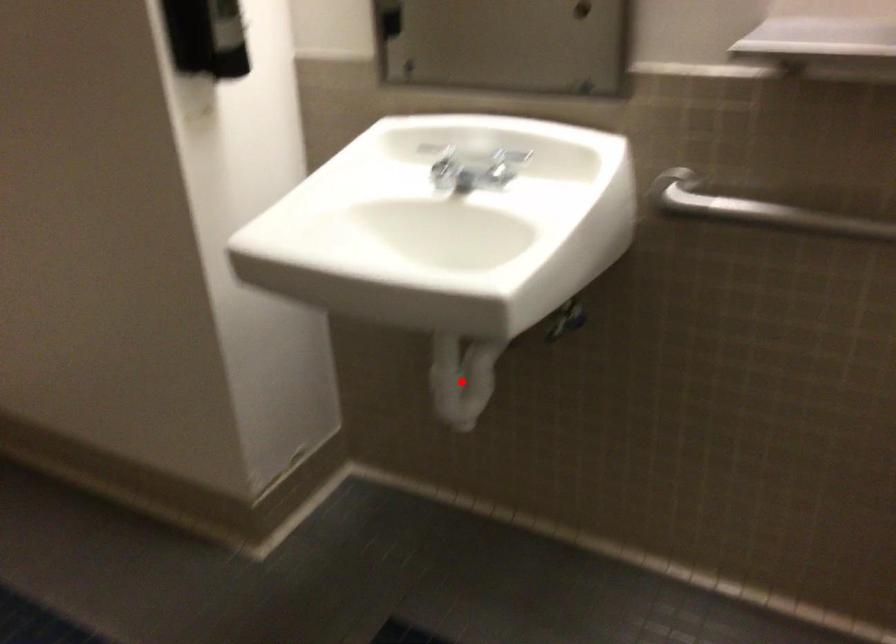
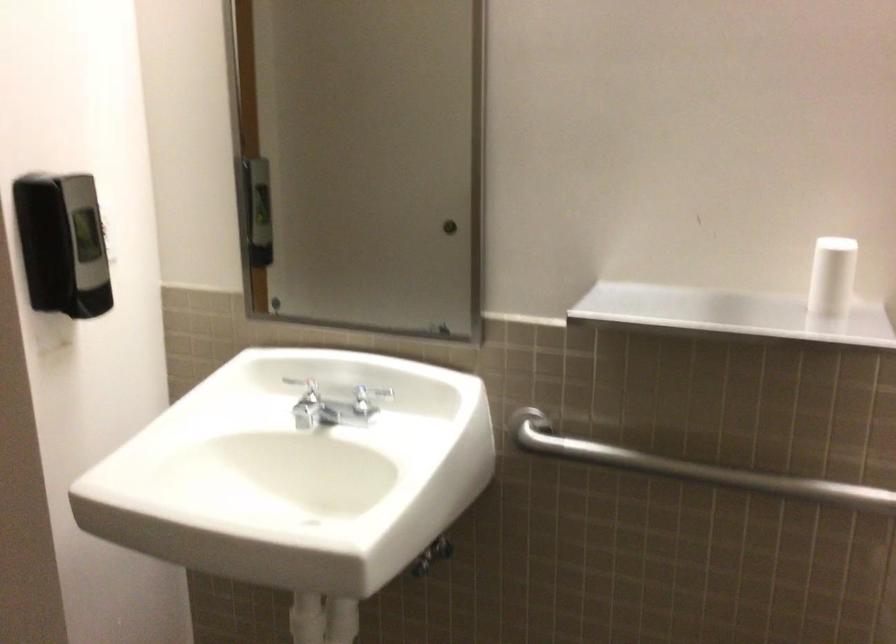
The point at the highlighted location is marked in the first image. Where is the corresponding point in the second image?

(325, 623)